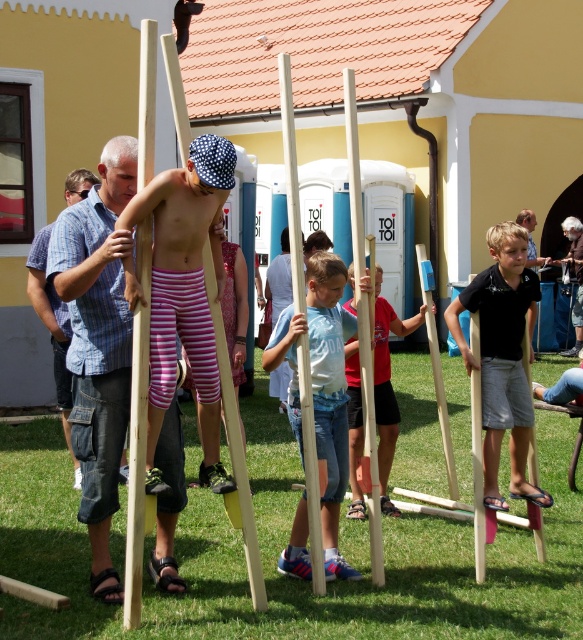
Question: Which point is closer to the camera?

Choices:
 (A) blue plaid shirt at left
 (B) wooden pole at center
 (C) pink striped shorts at center

Answer: (C)

Question: Is the position of blue plaid shirt at center less distant than that of smooth blue shorts at center?

Choices:
 (A) yes
 (B) no

Answer: (A)

Question: Is blue denim jeans at center below blue plaid shirt at left?

Choices:
 (A) yes
 (B) no

Answer: (A)

Question: Which of the following is the closest to the observer?

Choices:
 (A) black matte shirt at right
 (B) smooth blue shorts at center
 (C) pink striped shorts at center

Answer: (C)

Question: Is blue denim jeans at center closer to the viewer compared to wooden pole at center?

Choices:
 (A) yes
 (B) no

Answer: (B)

Question: Among these objects, which one is farthest from the camera?

Choices:
 (A) wooden pole at center
 (B) pink striped shorts at center

Answer: (A)